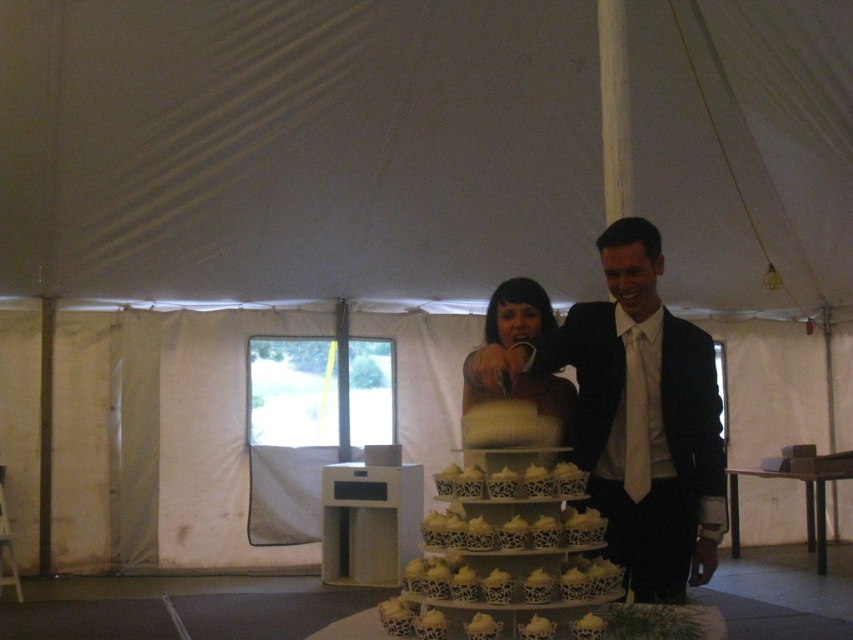
Between white fabric canopy at upper center and matte black suit at center, which one appears on the left side from the viewer's perspective?

From the viewer's perspective, matte black suit at center appears more on the left side.

Can you confirm if white fabric canopy at upper center is positioned to the left of matte black suit at center?

In fact, white fabric canopy at upper center is to the right of matte black suit at center.

Which is behind, point (73, 45) or point (630, 512)?

Point (73, 45)

This screenshot has width=853, height=640. I want to click on white fabric canopy at upper center, so pyautogui.click(x=422, y=148).

Which of these two, white fabric canopy at upper center or white lace cupcake tower at center, stands shorter?

white lace cupcake tower at center

Between point (399, 118) and point (451, 561), which one is positioned behind?

Positioned behind is point (399, 118).

Is point (91, 36) farther from viewer compared to point (579, 493)?

Yes, point (91, 36) is farther from viewer.

Locate an element on the screen. This screenshot has width=853, height=640. white fabric canopy at upper center is located at coordinates (422, 148).

Where is `matte black suit at center`? The image size is (853, 640). matte black suit at center is located at coordinates (643, 419).

Is matte black suit at center thinner than white lace cupcake tower at center?

Incorrect, matte black suit at center's width is not less than white lace cupcake tower at center's.

Does point (604, 440) come farther from viewer compared to point (520, 577)?

Yes, it is behind point (520, 577).

Locate an element on the screen. This screenshot has height=640, width=853. matte black suit at center is located at coordinates (643, 419).